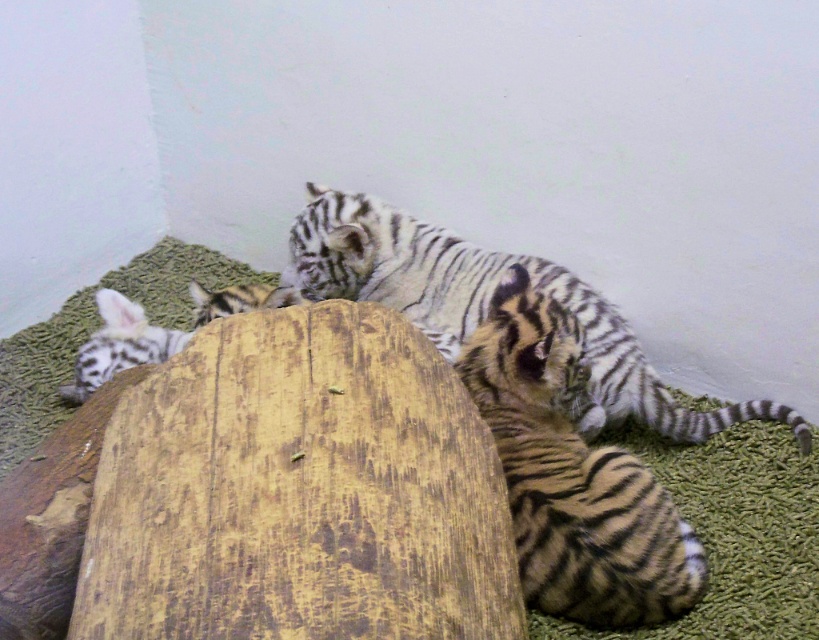
Does striped fur tiger at lower right appear over striped fur tiger at center?

No, striped fur tiger at lower right is not above striped fur tiger at center.

Does point (551, 308) lie in front of point (649, 410)?

Yes, it is in front of point (649, 410).

At what (x,y) coordinates should I click in order to perform the action: click on striped fur tiger at lower right. Please return your answer as a coordinate pair (x, y). Looking at the image, I should click on click(x=572, y=476).

Is the position of striped fur tiger at lower right more distant than that of striped fur tiger at lower left?

No.

Who is more forward, (500, 384) or (109, 298)?

Point (500, 384) is in front.

Identify the location of striped fur tiger at lower right. Image resolution: width=819 pixels, height=640 pixels. (572, 476).

Consider the image. Which is more to the right, striped fur tiger at center or striped fur tiger at lower left?

striped fur tiger at center is more to the right.

Is striped fur tiger at center wider than striped fur tiger at lower left?

Yes.

Which is in front, point (415, 248) or point (156, 342)?

Point (156, 342) is more forward.

Locate an element on the screen. This screenshot has width=819, height=640. striped fur tiger at center is located at coordinates (486, 305).